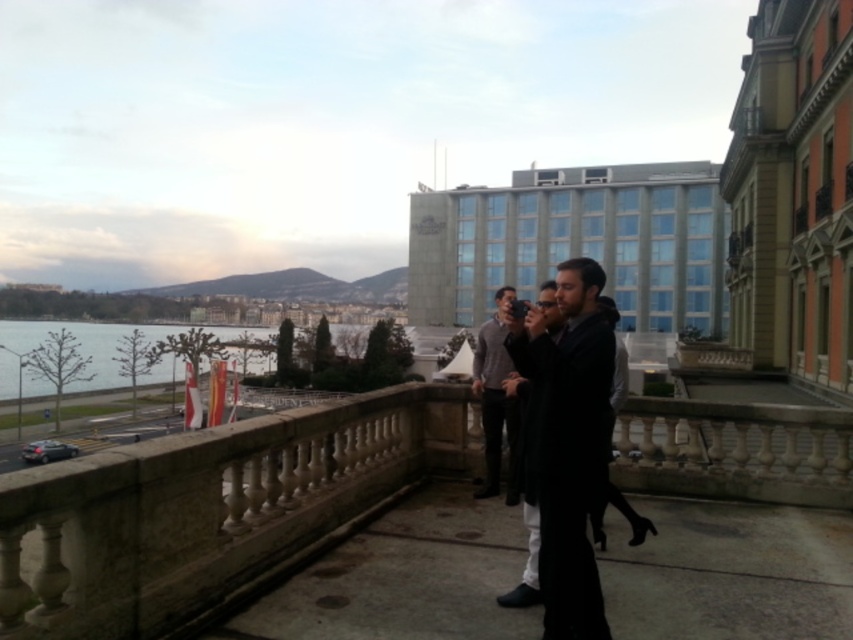
Is black fabric coat at center shorter than blue water at lower left?

Yes.

Can you confirm if black fabric coat at center is positioned below blue water at lower left?

Actually, black fabric coat at center is above blue water at lower left.

What are the coordinates of `black fabric coat at center` in the screenshot? It's located at coord(566,436).

Is blue water at lower left bigger than black leather dress at center?

Correct, blue water at lower left is larger in size than black leather dress at center.

Does blue water at lower left have a greater width compared to black leather dress at center?

Yes, blue water at lower left is wider than black leather dress at center.

The width and height of the screenshot is (853, 640). What do you see at coordinates (106, 342) in the screenshot?
I see `blue water at lower left` at bounding box center [106, 342].

Image resolution: width=853 pixels, height=640 pixels. Identify the location of blue water at lower left. (106, 342).

Who is higher up, blue water at lower left or gray sweater at center?

gray sweater at center is above.

Is blue water at lower left positioned in front of gray sweater at center?

That is False.

At what (x,y) coordinates should I click in order to perform the action: click on blue water at lower left. Please return your answer as a coordinate pair (x, y). This screenshot has height=640, width=853. Looking at the image, I should click on (106, 342).